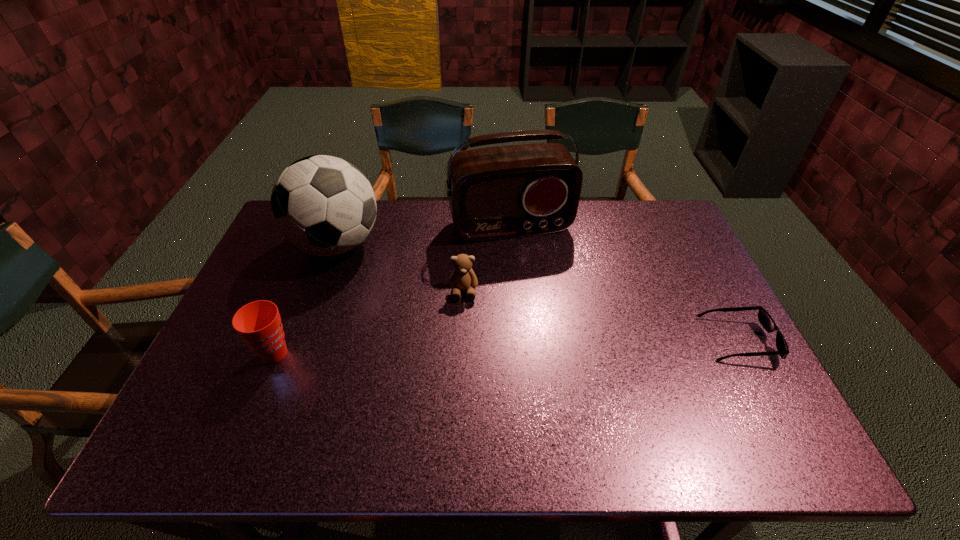
You are a GUI agent. You are given a task and a screenshot of the screen. Output one action in this format:
    pyautogui.click(x=<x>, y=<y>)
    Task: Click on the soccer ball at the left edge
    The image size is (960, 540).
    Given the screenshot: What is the action you would take?
    coord(322,205)

Find the location of a particular element. The width and height of the screenshot is (960, 540). object that is at the right edge is located at coordinates (765, 319).

Identify the location of object positioned at the far left corner. (322, 205).

The width and height of the screenshot is (960, 540). Find the location of `vacant space at the far edge`. vacant space at the far edge is located at coordinates (540, 236).

Find the location of a particular element. Image resolution: width=960 pixels, height=540 pixels. free space at the near edge of the desktop is located at coordinates (422, 396).

Find the location of a particular element. The image size is (960, 540). free space at the right edge is located at coordinates (720, 328).

Locate an element on the screen. The image size is (960, 540). blank space at the near left corner of the desktop is located at coordinates (220, 386).

Image resolution: width=960 pixels, height=540 pixels. In the image, there is a desktop. Identify the location of vacant region at the far right corner. (663, 211).

This screenshot has width=960, height=540. Identify the location of free space between the teddy bear and the soccer ball. (400, 268).

Identify the location of free space between the third nearest object and the rightmost object. This screenshot has width=960, height=540. (601, 316).